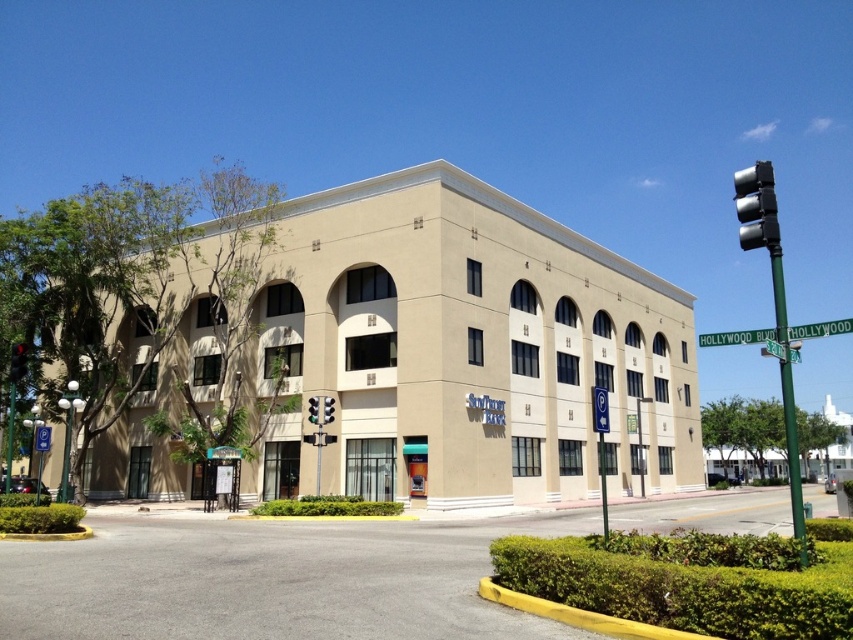
You are a delivery driver approaching the SunTrust Bank building. You need to park your van, which is 2.5 meters wide. The parking spot is between the green wood street sign at upper right and the black plastic traffic light at left. Can your van fit in this space?

The green wood street sign at upper right is wider than the black plastic traffic light at left. However, since the exact width of the parking space isn

You are a pedestrian standing on the sidewalk in front of the SunTrust Bank building. You see a black plastic traffic light at left and a metallic traffic light at center. Which traffic light is nearer to you?

The black plastic traffic light at left is closer to the viewer than the metallic traffic light at center, so the black plastic traffic light at left is nearer to you.